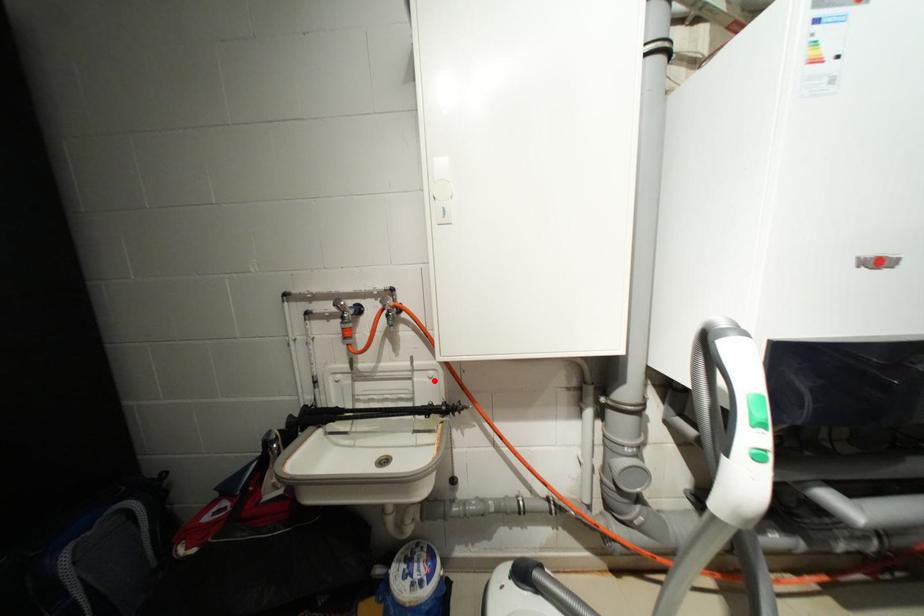
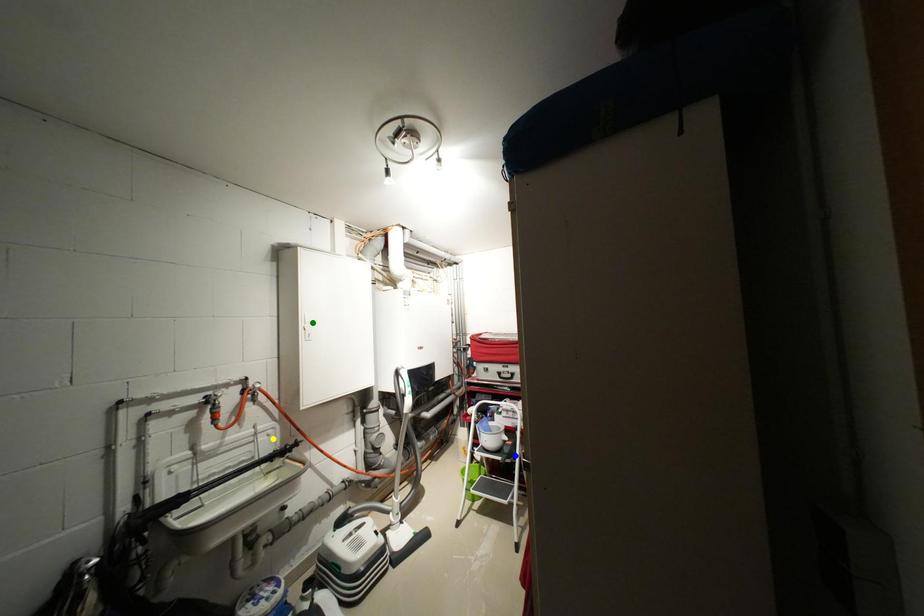
Question: I am providing you with two images of the same scene from different viewpoints. A red point is marked on the first image. You are given multiple points on the second image. Can you choose the point in image 2 that corresponds to the point in image 1?

Choices:
 (A) yellow point
 (B) blue point
 (C) green point

Answer: (A)